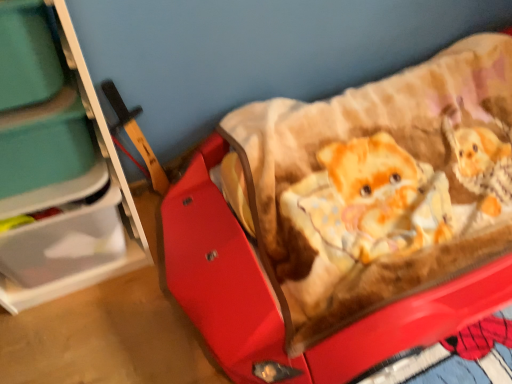
Question: From the image's perspective, is teal plastic storage box at left positioned above or below red plastic baby carriage at center?

Choices:
 (A) above
 (B) below

Answer: (A)

Question: Is teal plastic storage box at left wider or thinner than red plastic baby carriage at center?

Choices:
 (A) wide
 (B) thin

Answer: (B)

Question: Estimate the real-world distances between objects in this image. Which object is farther from the red plastic baby carriage at center?

Choices:
 (A) translucent plastic storage at left
 (B) teal plastic storage box at left

Answer: (B)

Question: Estimate the real-world distances between objects in this image. Which object is farther from the red plastic baby carriage at center?

Choices:
 (A) translucent plastic storage at left
 (B) teal plastic storage box at left

Answer: (B)